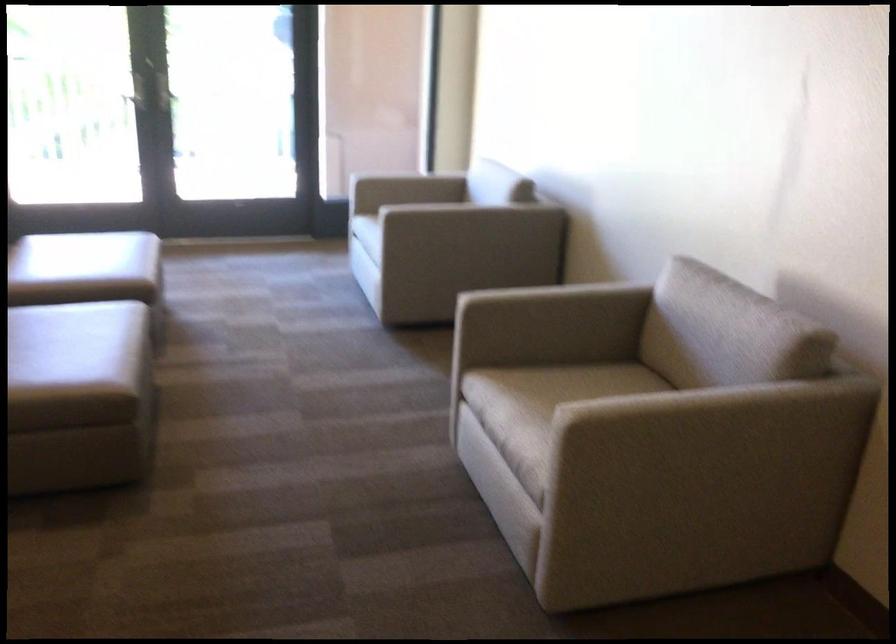
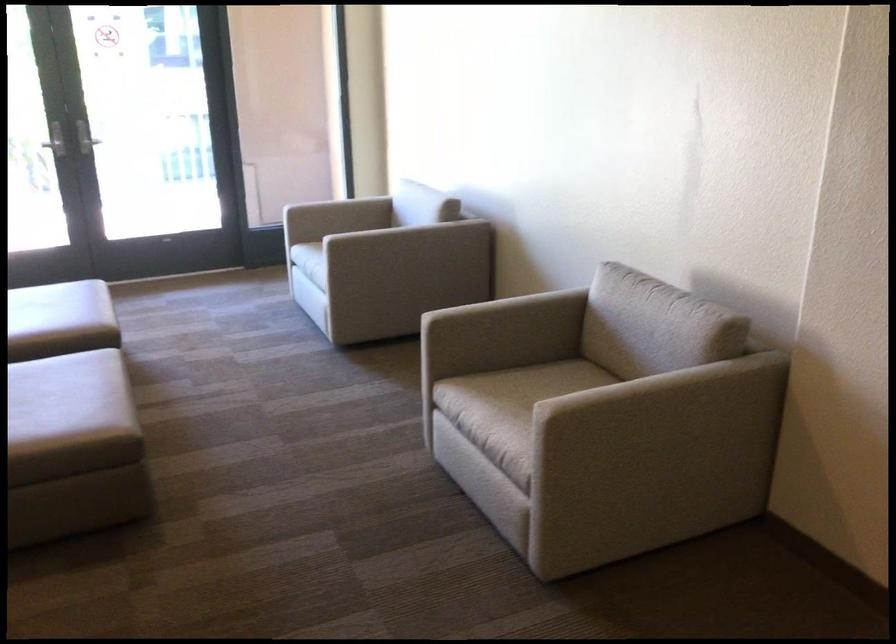
The point at (x=374, y=211) is marked in the first image. Where is the corresponding point in the second image?

(316, 240)